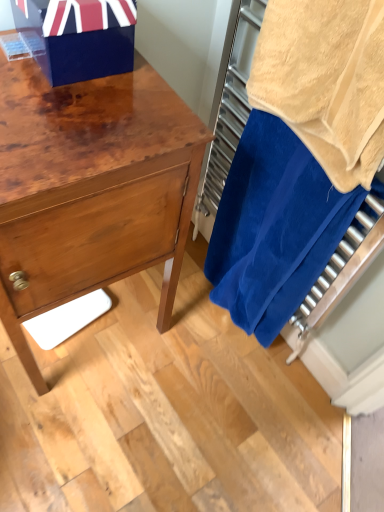
You are a GUI agent. You are given a task and a screenshot of the screen. Output one action in this format:
    pyautogui.click(x=<x>, y=<y>)
    Task: Click on the free space above shiny wood chest of drawers at left (from a real-world perspective)
    
    Given the screenshot: What is the action you would take?
    pyautogui.click(x=71, y=104)